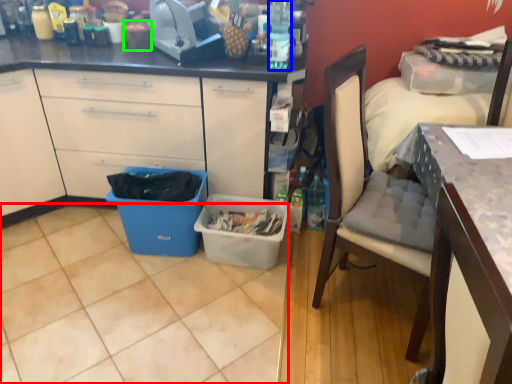
Question: Considering the real-world distances, which object is closest to tile (highlighted by a red box)? bottle (highlighted by a blue box) or coffee cup (highlighted by a green box).

Choices:
 (A) bottle
 (B) coffee cup

Answer: (A)